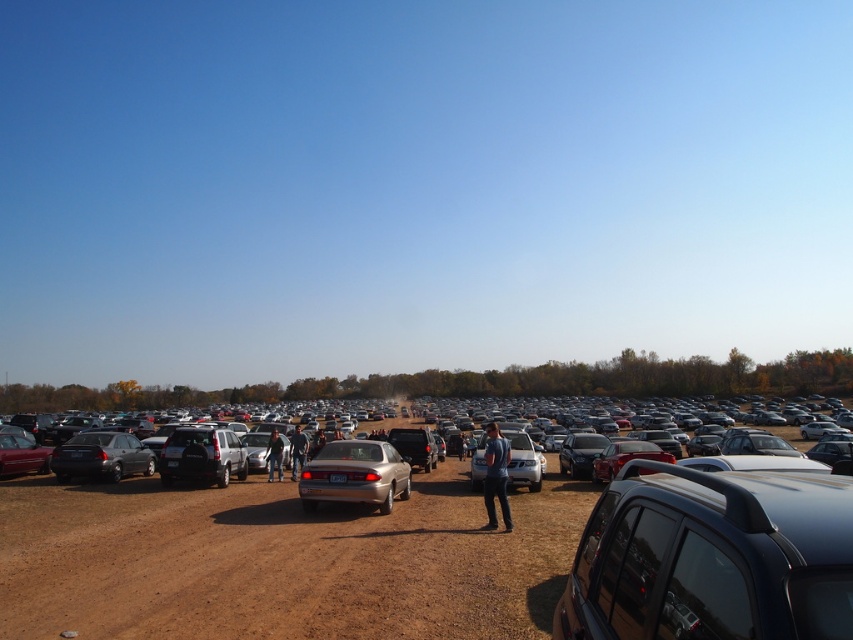
You are standing at the edge of the open area and see the gold metallic sedan at center and the denim pants at center. Which object is positioned more to the right side of the scene?

The gold metallic sedan at center is positioned more to the right side of the scene than the denim pants at center.

You are standing at the left edge of the parking area and want to walk to the shiny silver car at center. Which direction should you move relative to the shiny black suv at right?

The shiny black suv at right is to the left of the shiny silver car at center, so you should move towards the right past the shiny black suv at right to reach the shiny silver car at center.

You are standing in the open area and want to reach the shiny black suv at right. Considering your height is 5 feet 6 inches, can you comfortably walk to it without bending down?

The shiny black suv at right is 5.46 feet away from viewer. Since the distance is less than your height, you can comfortably walk to it without needing to bend down.